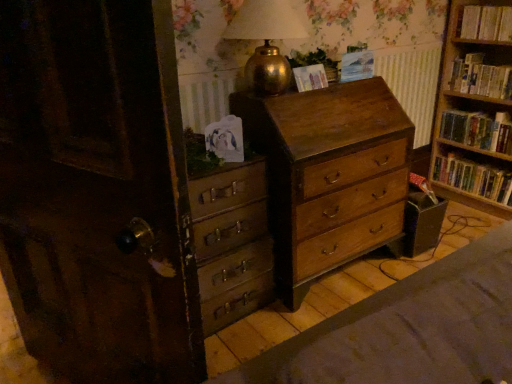
What do you see at coordinates (329, 175) in the screenshot? The width and height of the screenshot is (512, 384). I see `wooden chest of drawers at center, which is the 1th chest of drawers in right-to-left order` at bounding box center [329, 175].

Describe the element at coordinates (481, 77) in the screenshot. This screenshot has height=384, width=512. I see `hardcover books at right, the second book when ordered from top to bottom` at that location.

I want to click on gold metallic table lamp at upper center, so click(x=266, y=43).

In order to face blue paper at upper center, which is the second paperback book in left-to-right order, should I rotate leftwards or rightwards?

To align with it, rotate right about 12.890°.

The height and width of the screenshot is (384, 512). What do you see at coordinates (487, 23) in the screenshot?
I see `hardcover books at upper right, acting as the 1th book starting from the top` at bounding box center [487, 23].

This screenshot has width=512, height=384. I want to click on hardcover book at right, placed as the third book when sorted from top to bottom, so click(478, 130).

What do you see at coordinates (478, 130) in the screenshot? The height and width of the screenshot is (384, 512). I see `hardcover book at right, positioned as the 2th book in bottom-to-top order` at bounding box center [478, 130].

Find the location of `wooden bookshelf at right, the first book when ordered from bottom to top`. wooden bookshelf at right, the first book when ordered from bottom to top is located at coordinates (473, 178).

Considering the relative positions of gold metallic table lamp at upper center and wooden chest of drawers at center, which is the second chest of drawers in right-to-left order, in the image provided, is gold metallic table lamp at upper center to the left of wooden chest of drawers at center, which is the second chest of drawers in right-to-left order, from the viewer's perspective?

Incorrect, gold metallic table lamp at upper center is not on the left side of wooden chest of drawers at center, which is the second chest of drawers in right-to-left order.

Considering the points (267, 47) and (225, 227), which point is behind, point (267, 47) or point (225, 227)?

The point (267, 47) is behind.

From a real-world perspective, who is located higher, gold metallic table lamp at upper center or wooden chest of drawers at center, which is the second chest of drawers in right-to-left order?

gold metallic table lamp at upper center.

How many degrees apart are the facing directions of gold metallic table lamp at upper center and wooden chest of drawers at center, which is the second chest of drawers in right-to-left order?

The angle between the facing direction of gold metallic table lamp at upper center and the facing direction of wooden chest of drawers at center, which is the second chest of drawers in right-to-left order, is 4.34 degrees.

From a real-world perspective, which object stands above the other?

From a 3D spatial view, hardcover books at upper right, acting as the 1th book starting from the top, is above.

Is hardcover books at upper right, acting as the 1th book starting from the top, positioned with its back to blue paper at upper center, which is counted as the 1th paperback book, starting from the right?

No, hardcover books at upper right, acting as the 1th book starting from the top, is not facing away from blue paper at upper center, which is counted as the 1th paperback book, starting from the right.

From the image's perspective, which is below, hardcover books at upper right, acting as the 1th book starting from the top, or blue paper at upper center, which is counted as the 1th paperback book, starting from the right?

blue paper at upper center, which is counted as the 1th paperback book, starting from the right, is shown below in the image.

Which point is more distant from viewer, (502, 30) or (348, 77)?

The point (502, 30) is farther.

Considering the positions of points (396, 171) and (470, 18), is point (396, 171) farther from camera compared to point (470, 18)?

No, it is in front of (470, 18).

Considering the relative sizes of wooden chest of drawers at center, which is the 1th chest of drawers in right-to-left order, and hardcover books at upper right, the fourth book when ordered from bottom to top, in the image provided, is wooden chest of drawers at center, which is the 1th chest of drawers in right-to-left order, wider than hardcover books at upper right, the fourth book when ordered from bottom to top,?

Yes.

How different are the orientations of wooden chest of drawers at center, which is the 1th chest of drawers in right-to-left order, and hardcover books at upper right, the fourth book when ordered from bottom to top, in degrees?

87.9 degrees separate the facing orientations of wooden chest of drawers at center, which is the 1th chest of drawers in right-to-left order, and hardcover books at upper right, the fourth book when ordered from bottom to top.

Considering the positions of objects wooden chest of drawers at center, the 2th chest of drawers positioned from the left, and hardcover books at upper right, the fourth book when ordered from bottom to top, in the image provided, who is more to the left, wooden chest of drawers at center, the 2th chest of drawers positioned from the left, or hardcover books at upper right, the fourth book when ordered from bottom to top,?

wooden chest of drawers at center, the 2th chest of drawers positioned from the left, is more to the left.

Consider the image. Is wooden bookshelf at right, the fourth book from the top, turned away from blue paper at upper center, which is the second paperback book in left-to-right order?

wooden bookshelf at right, the fourth book from the top, does not have its back to blue paper at upper center, which is the second paperback book in left-to-right order.

Is wooden bookshelf at right, the fourth book from the top, wider or thinner than blue paper at upper center, which is the second paperback book in left-to-right order?

Considering their sizes, wooden bookshelf at right, the fourth book from the top, looks broader than blue paper at upper center, which is the second paperback book in left-to-right order.

Is wooden bookshelf at right, the first book when ordered from bottom to top, in contact with blue paper at upper center, which is the second paperback book in left-to-right order?

No, wooden bookshelf at right, the first book when ordered from bottom to top, is not touching blue paper at upper center, which is the second paperback book in left-to-right order.

From the image's perspective, is wooden bookshelf at right, the first book when ordered from bottom to top, above blue paper at upper center, which is counted as the 1th paperback book, starting from the right?

No, from the image's perspective, wooden bookshelf at right, the first book when ordered from bottom to top, is not on top of blue paper at upper center, which is counted as the 1th paperback book, starting from the right.

Where is `chest of drawers located on the left of matte paper at upper center, which is the first paperback book from left to right`? chest of drawers located on the left of matte paper at upper center, which is the first paperback book from left to right is located at coordinates (232, 244).

How many degrees apart are the facing directions of matte paper at upper center, which is the first paperback book from left to right, and wooden chest of drawers at center, which is counted as the first chest of drawers, starting from the left?

There is a 7.75-degree angle between the facing directions of matte paper at upper center, which is the first paperback book from left to right, and wooden chest of drawers at center, which is counted as the first chest of drawers, starting from the left.

Considering the positions of point (325, 84) and point (212, 189), is point (325, 84) closer or farther from the camera than point (212, 189)?

Clearly, point (325, 84) is more distant from the camera than point (212, 189).

Is matte paper at upper center, which is the first paperback book from left to right, oriented away from wooden chest of drawers at center, which is counted as the first chest of drawers, starting from the left?

No, matte paper at upper center, which is the first paperback book from left to right, is not facing the opposite direction of wooden chest of drawers at center, which is counted as the first chest of drawers, starting from the left.

Is gold metallic table lamp at upper center placed right next to hardcover books at upper right, acting as the 1th book starting from the top?

No.

What are the coordinates of `table lamp below the hardcover books at upper right, acting as the 1th book starting from the top (from the image's perspective)` in the screenshot? It's located at (266, 43).

From the image's perspective, is gold metallic table lamp at upper center on hardcover books at upper right, acting as the 1th book starting from the top?

Actually, gold metallic table lamp at upper center appears below hardcover books at upper right, acting as the 1th book starting from the top, in the image.

From the picture: Who is bigger, gold metallic table lamp at upper center or hardcover books at upper right, acting as the 1th book starting from the top?

With larger size is gold metallic table lamp at upper center.

Is wooden chest of drawers at center, which is the second chest of drawers in right-to-left order, inside or outside of hardcover books at upper right, the fourth book when ordered from bottom to top?

wooden chest of drawers at center, which is the second chest of drawers in right-to-left order, exists outside the volume of hardcover books at upper right, the fourth book when ordered from bottom to top.

From the picture: Is wooden chest of drawers at center, which is counted as the first chest of drawers, starting from the left, aimed at hardcover books at upper right, acting as the 1th book starting from the top?

No, wooden chest of drawers at center, which is counted as the first chest of drawers, starting from the left, is not oriented towards hardcover books at upper right, acting as the 1th book starting from the top.

From the image's perspective, which one is positioned lower, wooden chest of drawers at center, which is the second chest of drawers in right-to-left order, or hardcover books at upper right, acting as the 1th book starting from the top?

From the image's view, wooden chest of drawers at center, which is the second chest of drawers in right-to-left order, is below.

Where is `the 1st book behind the wooden chest of drawers at center, which is the second chest of drawers in right-to-left order, starting your count from the anchor`? This screenshot has width=512, height=384. the 1st book behind the wooden chest of drawers at center, which is the second chest of drawers in right-to-left order, starting your count from the anchor is located at coordinates (487, 23).

From the image's perspective, which chest of drawers is the 2nd one below the gold metallic table lamp at upper center? Please provide its 2D coordinates.

[(232, 244)]

This screenshot has height=384, width=512. Identify the location of paperback book that is the 1st object located in front of the hardcover books at upper right, acting as the 1th book starting from the top. (357, 66).

Which object lies nearer to the anchor point gold metallic table lamp at upper center, wooden bookshelf at right, the fourth book from the top, or wooden chest of drawers at center, which is the second chest of drawers in right-to-left order?

Based on the image, wooden chest of drawers at center, which is the second chest of drawers in right-to-left order, appears to be nearer to gold metallic table lamp at upper center.

Looking at the image, which one is located closer to wooden bookshelf at right, the first book when ordered from bottom to top, hardcover books at right, the second book when ordered from top to bottom, or blue paper at upper center, which is the second paperback book in left-to-right order?

hardcover books at right, the second book when ordered from top to bottom, is positioned closer to the anchor wooden bookshelf at right, the first book when ordered from bottom to top.

Looking at the image, which one is located closer to hardcover books at right, the second book when ordered from top to bottom, hardcover book at right, placed as the third book when sorted from top to bottom, or wooden bookshelf at right, the fourth book from the top?

The object closer to hardcover books at right, the second book when ordered from top to bottom, is hardcover book at right, placed as the third book when sorted from top to bottom.

Looking at the image, which one is located further to hardcover books at upper right, the fourth book when ordered from bottom to top, gold metallic table lamp at upper center or hardcover books at right, placed as the 3th book when sorted from bottom to top?

gold metallic table lamp at upper center is positioned further to the anchor hardcover books at upper right, the fourth book when ordered from bottom to top.

Based on their spatial positions, is hardcover books at upper right, acting as the 1th book starting from the top, or wooden chest of drawers at center, which is the second chest of drawers in right-to-left order, closer to wooden chest of drawers at center, the 2th chest of drawers positioned from the left?

wooden chest of drawers at center, which is the second chest of drawers in right-to-left order, is positioned closer to the anchor wooden chest of drawers at center, the 2th chest of drawers positioned from the left.

When comparing their distances from hardcover books at right, placed as the 3th book when sorted from bottom to top, does wooden bookshelf at right, the first book when ordered from bottom to top, or hardcover books at upper right, acting as the 1th book starting from the top, seem further?

wooden bookshelf at right, the first book when ordered from bottom to top.

When comparing their distances from wooden chest of drawers at center, which is counted as the first chest of drawers, starting from the left, does blue paper at upper center, which is counted as the 1th paperback book, starting from the right, or wooden chest of drawers at center, which is the 1th chest of drawers in right-to-left order, seem closer?

Based on the image, wooden chest of drawers at center, which is the 1th chest of drawers in right-to-left order, appears to be nearer to wooden chest of drawers at center, which is counted as the first chest of drawers, starting from the left.

Estimate the real-world distances between objects in this image. Which object is closer to blue paper at upper center, which is the second paperback book in left-to-right order, wooden chest of drawers at center, which is counted as the first chest of drawers, starting from the left, or wooden bookshelf at right, the fourth book from the top?

Based on the image, wooden chest of drawers at center, which is counted as the first chest of drawers, starting from the left, appears to be nearer to blue paper at upper center, which is the second paperback book in left-to-right order.

You are a GUI agent. You are given a task and a screenshot of the screen. Output one action in this format:
    pyautogui.click(x=<x>, y=<y>)
    Task: Click on the chest of drawers between wooden chest of drawers at center, which is the second chest of drawers in right-to-left order, and hardcover book at right, placed as the third book when sorted from top to bottom
    This screenshot has width=512, height=384.
    Given the screenshot: What is the action you would take?
    click(x=329, y=175)

Find the location of a particular element. This screenshot has height=384, width=512. the chest of drawers situated between gold metallic table lamp at upper center and wooden bookshelf at right, the fourth book from the top, from left to right is located at coordinates (329, 175).

Where is `paperback book between gold metallic table lamp at upper center and blue paper at upper center, which is counted as the 1th paperback book, starting from the right, along the z-axis`? paperback book between gold metallic table lamp at upper center and blue paper at upper center, which is counted as the 1th paperback book, starting from the right, along the z-axis is located at coordinates (310, 77).

The image size is (512, 384). Find the location of `chest of drawers between wooden chest of drawers at center, which is the second chest of drawers in right-to-left order, and hardcover books at right, the second book when ordered from top to bottom, in the horizontal direction`. chest of drawers between wooden chest of drawers at center, which is the second chest of drawers in right-to-left order, and hardcover books at right, the second book when ordered from top to bottom, in the horizontal direction is located at coordinates (329, 175).